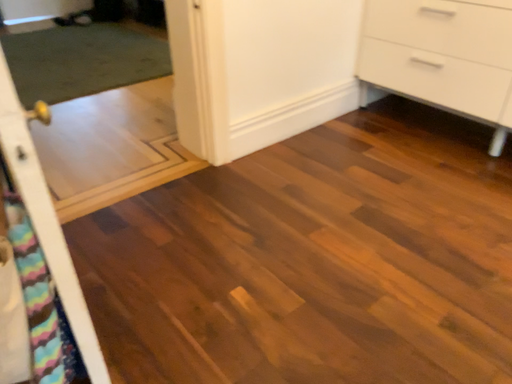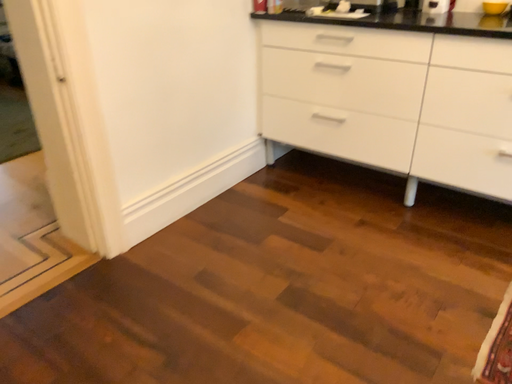
Question: Which way did the camera rotate in the video?

Choices:
 (A) rotated left
 (B) rotated right

Answer: (B)